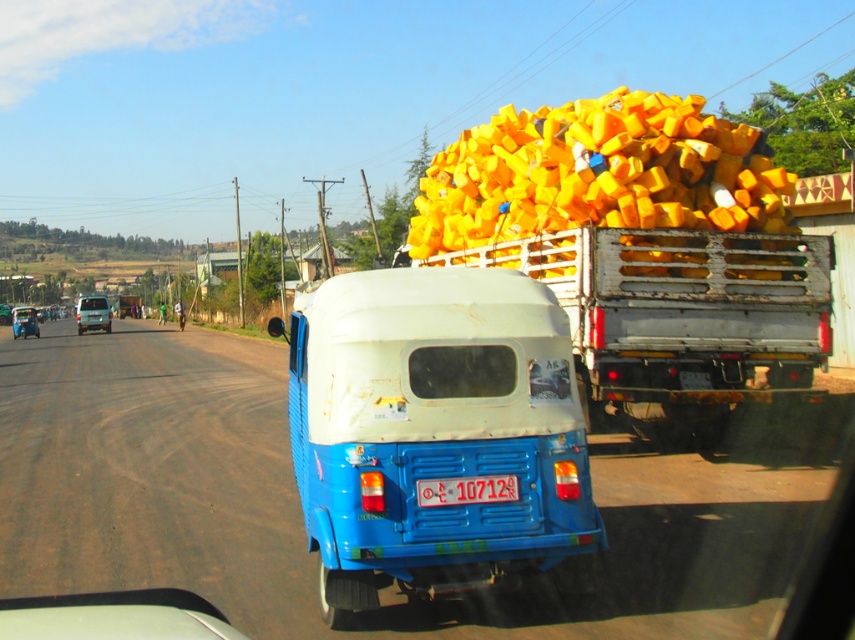
Question: Which is farther from the yellow plastic containers at upper right?

Choices:
 (A) white plastic license plate at rear
 (B) rusty metal truck at right
 (C) white matte auto rickshaw at center

Answer: (A)

Question: Is yellow plastic containers at upper right wider than white plastic license plate at rear?

Choices:
 (A) no
 (B) yes

Answer: (B)

Question: Which of the following is the farthest from the observer?

Choices:
 (A) (638, 240)
 (B) (413, 234)
 (C) (441, 484)

Answer: (B)

Question: Is rusty metal truck at right above white plastic license plate at rear?

Choices:
 (A) no
 (B) yes

Answer: (B)

Question: Which object is positioned closest to the yellow plastic containers at upper right?

Choices:
 (A) white matte auto rickshaw at center
 (B) rusty metal truck at right

Answer: (B)

Question: Can you confirm if rusty metal truck at right is bigger than white plastic license plate at rear?

Choices:
 (A) yes
 (B) no

Answer: (A)